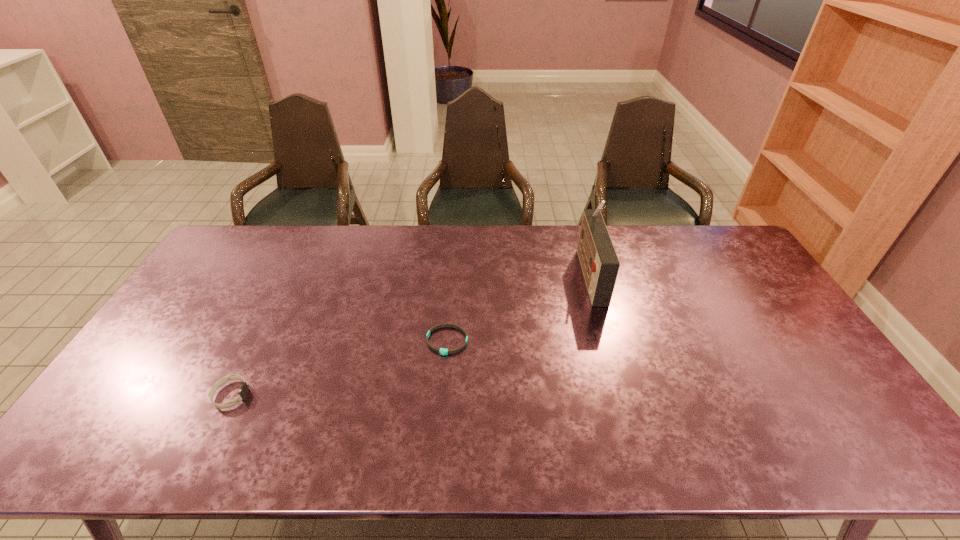
Find the location of `vacant area situated on the buckle of the right wristband`. vacant area situated on the buckle of the right wristband is located at coordinates (442, 410).

The image size is (960, 540). What are the coordinates of `object located in the far edge section of the desktop` in the screenshot? It's located at (599, 261).

You are a GUI agent. You are given a task and a screenshot of the screen. Output one action in this format:
    pyautogui.click(x=<x>, y=<y>)
    Task: Click on the free location at the far edge
    The height and width of the screenshot is (540, 960).
    Given the screenshot: What is the action you would take?
    pyautogui.click(x=277, y=231)

The height and width of the screenshot is (540, 960). I want to click on vacant space at the near edge of the desktop, so click(179, 438).

The width and height of the screenshot is (960, 540). What are the coordinates of `vacant region at the left edge of the desktop` in the screenshot? It's located at (218, 302).

Image resolution: width=960 pixels, height=540 pixels. Identify the location of vacant point at the right edge. (760, 310).

In the image, there is a desktop. Where is `vacant space at the near left corner`? The width and height of the screenshot is (960, 540). vacant space at the near left corner is located at coordinates (132, 446).

Find the location of `free spot between the shorter wristband and the nearest object`. free spot between the shorter wristband and the nearest object is located at coordinates (339, 368).

Find the location of a particular element. Image resolution: width=960 pixels, height=540 pixels. free space between the farther wristband and the tallest object is located at coordinates (518, 307).

Locate an element on the screen. free point between the left wristband and the rightmost object is located at coordinates (410, 334).